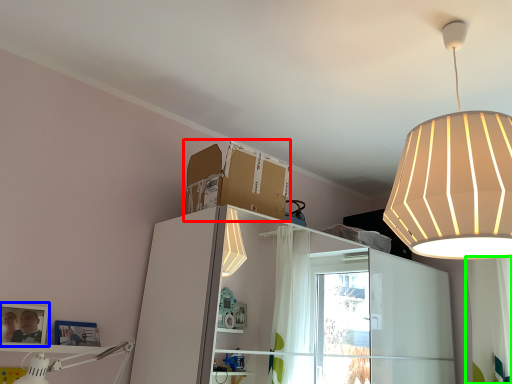
Question: Based on their relative distances, which object is farther from cardboard box (highlighted by a red box)? Choose from picture frame (highlighted by a blue box) and curtain (highlighted by a green box).

Choices:
 (A) picture frame
 (B) curtain

Answer: (B)